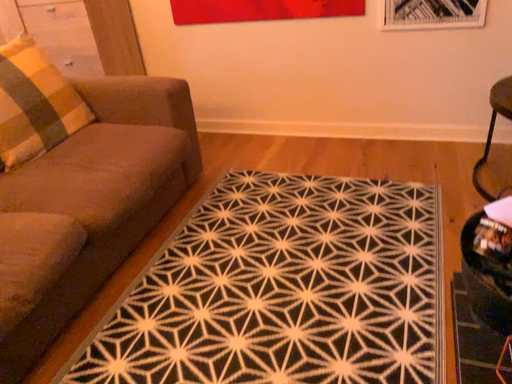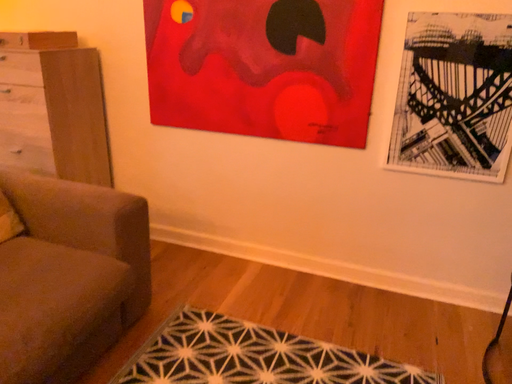
Question: Which way did the camera rotate in the video?

Choices:
 (A) rotated upward
 (B) rotated downward

Answer: (A)